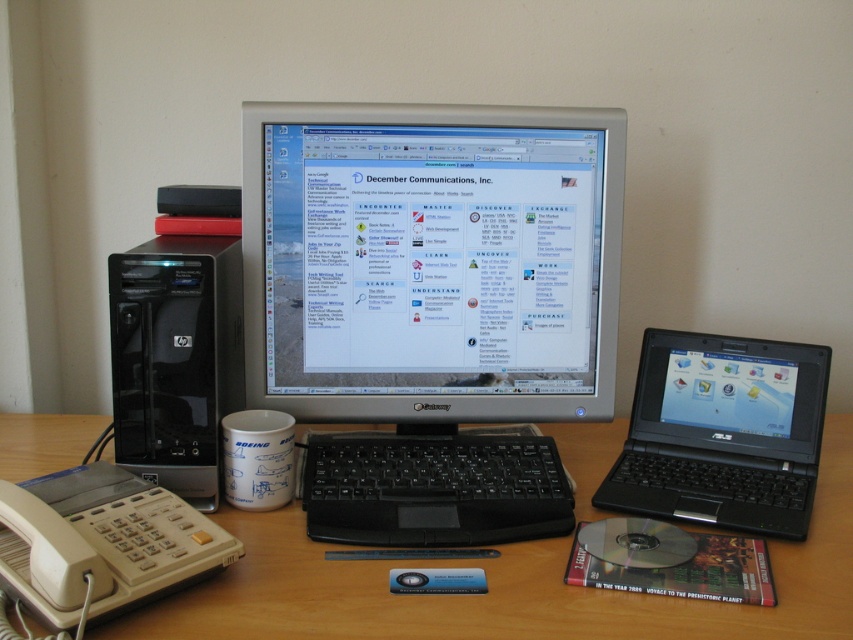
You are a remote worker who needs to position your black plastic laptop at right so that its camera is exactly 36 inches away from your face. Can you achieve this by moving the laptop as is, or do you need to adjust its position?

The black plastic laptop at right and camera are 35.40 inches apart. Since 35.40 inches is less than the required 36 inches, you need to move the laptop slightly further away to reach the desired distance.